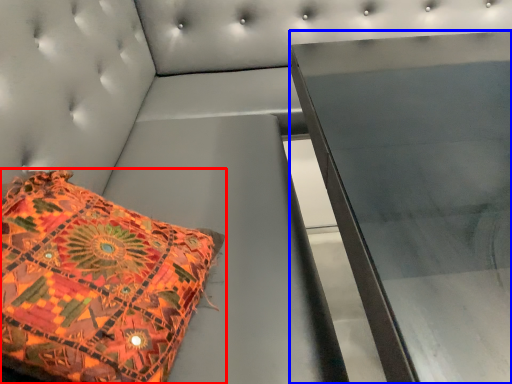
Question: Which point is closer to the camera, pillow (highlighted by a red box) or furniture (highlighted by a blue box)?

Choices:
 (A) pillow
 (B) furniture

Answer: (A)